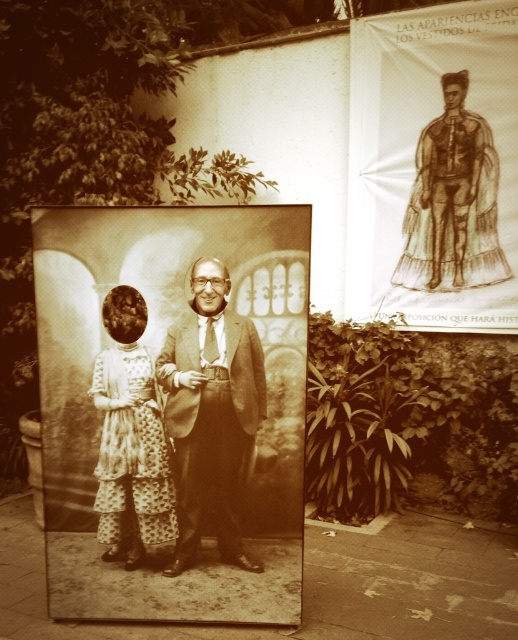
Looking at this image, you are an event planner organizing a vintage exhibition and need to arrange two items displayed on the right side of a large framed photo. The items are the brown paper poster at upper right and the brown paper dress at upper right. Based on their sizes, which one should you place higher up to ensure they both fit vertically on the display wall?

The brown paper poster at upper right is taller than the brown paper dress at upper right, so you should place the taller poster higher up to accommodate its height and ensure both fit vertically on the display wall.

You are an event organizer who needs to hang two items on a wall. You have a sepia textured poster at center and a smooth brown suit at center. Given that the wall space is limited, which item should you prioritize hanging first to make sure both fit?

The sepia textured poster at center has a larger size compared to the smooth brown suit at center, so you should prioritize hanging the sepia textured poster at center first to ensure both items fit within the limited wall space.